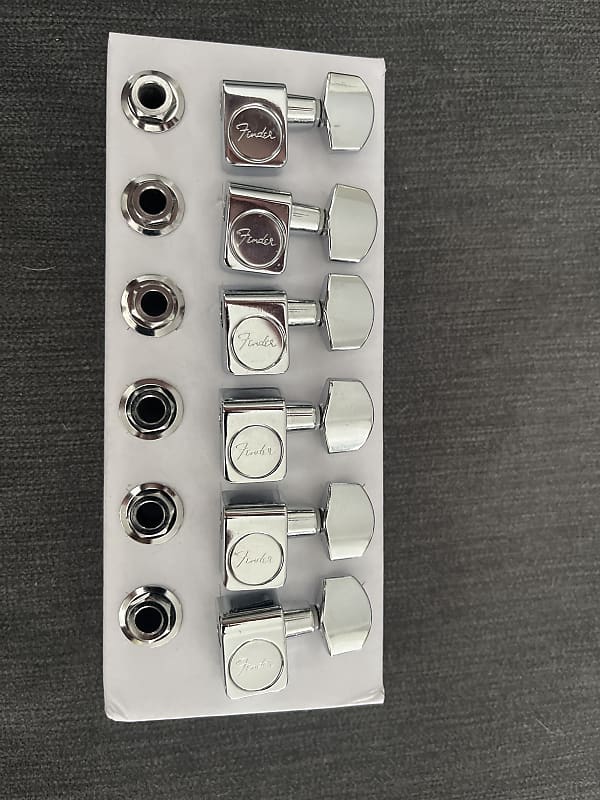
Where is `screws`? screws is located at coordinates [x=152, y=101], [x=154, y=201], [x=155, y=298], [x=154, y=406], [x=152, y=509], [x=141, y=618].